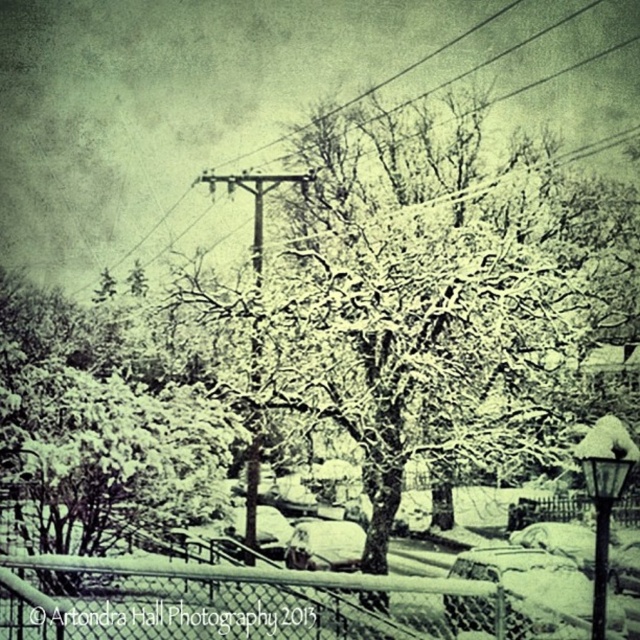
Question: Which point appears closest to the camera in this image?

Choices:
 (A) (476, 1)
 (B) (292, 173)

Answer: (B)

Question: Can you confirm if snow-covered wire at upper center is positioned to the right of wooden chain-link fence at lower center?

Choices:
 (A) no
 (B) yes

Answer: (B)

Question: Based on their relative distances, which object is farther from the snow-covered wire at upper center?

Choices:
 (A) wooden telegraph pole at center
 (B) wooden chain-link fence at lower center

Answer: (B)

Question: Which point is farther from the camera taking this photo?

Choices:
 (A) (216, 609)
 (B) (253, 481)

Answer: (B)

Question: Does snow-covered wire at upper center lie in front of wooden chain-link fence at lower center?

Choices:
 (A) yes
 (B) no

Answer: (B)

Question: Is wooden chain-link fence at lower center smaller than wooden telegraph pole at center?

Choices:
 (A) yes
 (B) no

Answer: (A)